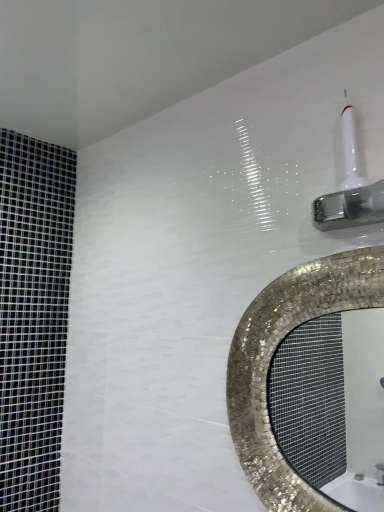
Question: Considering the relative positions of shiny mosaic mirror at upper right and white glossy shower head at upper right in the image provided, is shiny mosaic mirror at upper right to the left or to the right of white glossy shower head at upper right?

Choices:
 (A) left
 (B) right

Answer: (A)

Question: Which is correct: shiny mosaic mirror at upper right is inside white glossy shower head at upper right, or outside of it?

Choices:
 (A) outside
 (B) inside

Answer: (A)

Question: From a real-world perspective, is shiny mosaic mirror at upper right physically located above or below white glossy shower head at upper right?

Choices:
 (A) above
 (B) below

Answer: (B)

Question: Considering their positions, is white glossy shower head at upper right located in front of or behind shiny mosaic mirror at upper right?

Choices:
 (A) behind
 (B) front

Answer: (B)

Question: Does point (349, 159) appear closer or farther from the camera than point (350, 441)?

Choices:
 (A) closer
 (B) farther

Answer: (A)

Question: From the image's perspective, is white glossy shower head at upper right located above or below shiny mosaic mirror at upper right?

Choices:
 (A) above
 (B) below

Answer: (A)

Question: Considering the positions of white glossy shower head at upper right and shiny mosaic mirror at upper right in the image, is white glossy shower head at upper right wider or thinner than shiny mosaic mirror at upper right?

Choices:
 (A) wide
 (B) thin

Answer: (A)